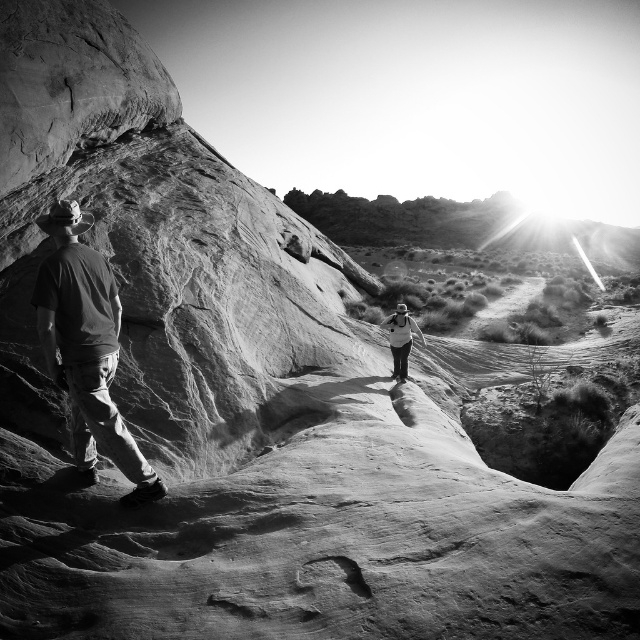
You are planning to take a photo of the dark gray fabric shirt at left and the white fabric backpack at center in the scene. The minimum distance required between the camera and the subjects for clear focus is 30 feet. Can you capture both subjects in focus from your current position?

The dark gray fabric shirt at left and white fabric backpack at center are 28.71 feet apart, which is less than the required 30 feet. Therefore, you cannot capture both subjects in focus from your current position.

You are a photographer trying to capture a photo of the dark gray fabric shirt at left and the white fabric backpack at center. Based on their positions, which one is closer to the camera?

The dark gray fabric shirt at left is below the white fabric backpack at center, which means it is closer to the camera.

You are a photographer trying to capture both the dark gray fabric shirt at left and the white fabric backpack at center in a single frame. Considering their sizes, which object would you need to focus on first to ensure both are in focus?

The dark gray fabric shirt at left has a smaller size compared to the white fabric backpack at center, so you should focus on the dark gray fabric shirt at left first to ensure both are in focus since it is closer to the camera.